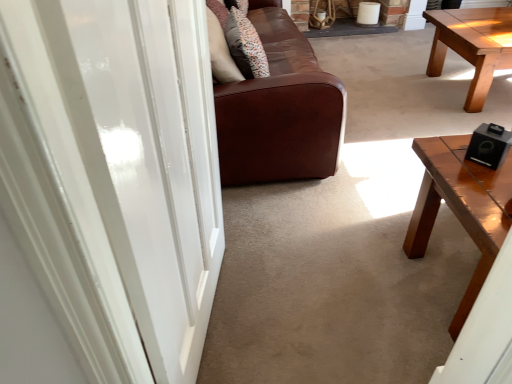
The image size is (512, 384). I want to click on vacant space in front of black matte speaker at right, so click(x=489, y=190).